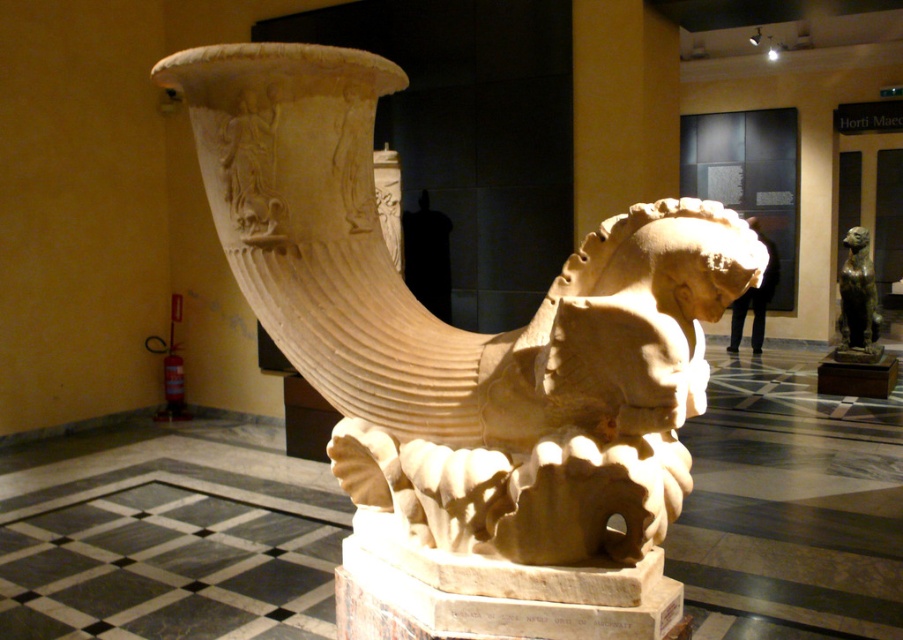
Question: Can you confirm if beige stone vase at center is thinner than bronze statue at right?

Choices:
 (A) yes
 (B) no

Answer: (B)

Question: Is beige stone vase at center smaller than bronze statue at right?

Choices:
 (A) yes
 (B) no

Answer: (B)

Question: Which point appears closest to the camera in this image?

Choices:
 (A) (415, 305)
 (B) (849, 241)

Answer: (A)

Question: Which point is closer to the camera taking this photo?

Choices:
 (A) (468, 374)
 (B) (870, 298)

Answer: (A)

Question: Is beige stone vase at center further to the viewer compared to bronze statue at right?

Choices:
 (A) no
 (B) yes

Answer: (A)